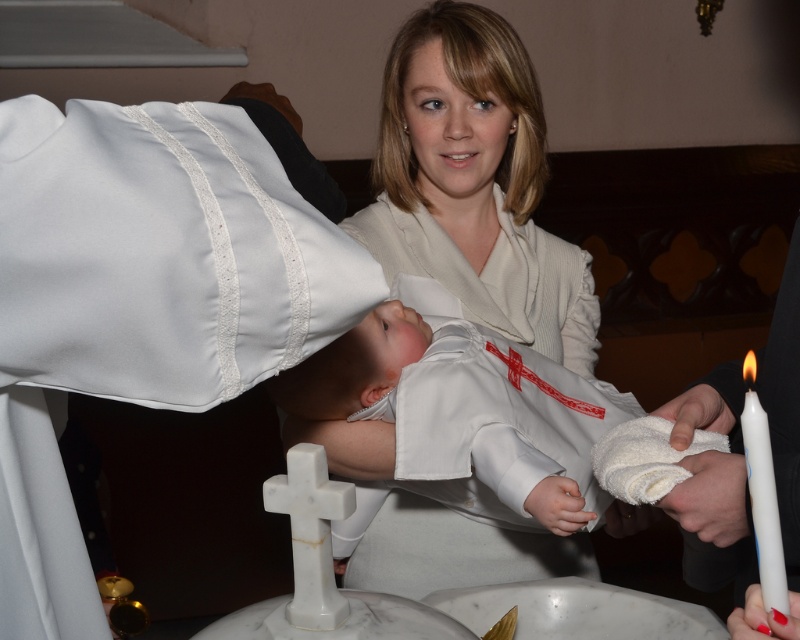
You are a photographer taking pictures of the baptism ceremony. You need to capture both the white smooth towel at lower right and the smooth white candle at lower right in the same frame. However, the candle is blocking the view of the towel. Is the candle in front of or behind the towel?

The white smooth towel at lower right is positioned over smooth white candle at lower right, meaning the candle is behind the towel.

You are a photographer capturing this baptism scene. You want to ensure the white satin baby at center and the white matte candle at right are both clearly visible in your photo. Since the candle is behind the baby, how should you adjust your camera angle to include both without one blocking the other?

Since the white matte candle at right is behind the white satin baby at center, you can angle your camera slightly upward to capture both objects without obstruction. This way, the candle will appear above and behind the baby, ensuring both are visible in the frame.

You are a photographer at the baptism ceremony. You need to position a small microphone stand between the white satin baby at center and the white matte candle at right. Given that the microphone stand requires 30 cm of space, can you fit it between them?

The white satin baby at center is wider than the white matte candle at right. However, the question is about the space between them, not their widths. Since the description only provides information about their widths relative to each other and not the distance between them, we cannot determine if the microphone stand will fit based on the given information.